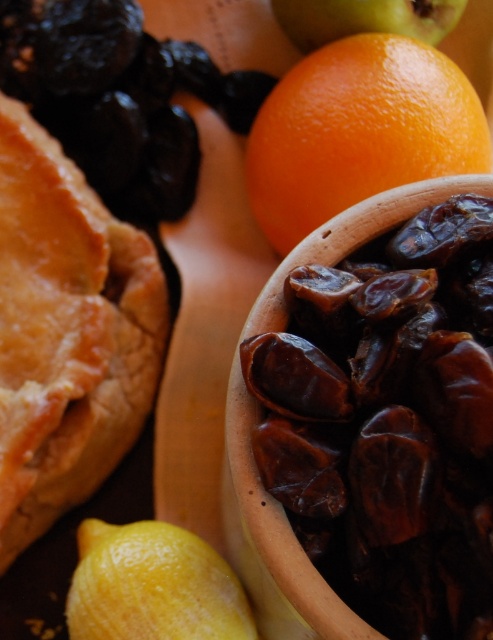
Does orange matte at upper right appear on the left side of smooth orange at upper center?

Yes, orange matte at upper right is to the left of smooth orange at upper center.

Does point (358, 54) lie in front of point (289, 24)?

Yes, it is in front of point (289, 24).

Locate an element on the screen. orange matte at upper right is located at coordinates (358, 131).

Image resolution: width=493 pixels, height=640 pixels. What are the coordinates of `orange matte at upper right` in the screenshot? It's located at (358, 131).

Does yellow matte lemon at lower left appear over smooth orange at upper center?

No, yellow matte lemon at lower left is not above smooth orange at upper center.

Who is shorter, yellow matte lemon at lower left or smooth orange at upper center?

Standing shorter between the two is smooth orange at upper center.

Is point (94, 564) farther from viewer compared to point (328, 17)?

No, (94, 564) is closer to viewer.

Locate an element on the screen. yellow matte lemon at lower left is located at coordinates (152, 586).

Between point (298, 426) and point (145, 616), which one is positioned in front?

Point (298, 426)

Which is below, brown matte dates at center right or yellow matte lemon at lower left?

yellow matte lemon at lower left is lower down.

Is point (301, 438) positioned in front of point (184, 582)?

That is True.

Locate an element on the screen. This screenshot has width=493, height=640. brown matte dates at center right is located at coordinates (375, 417).